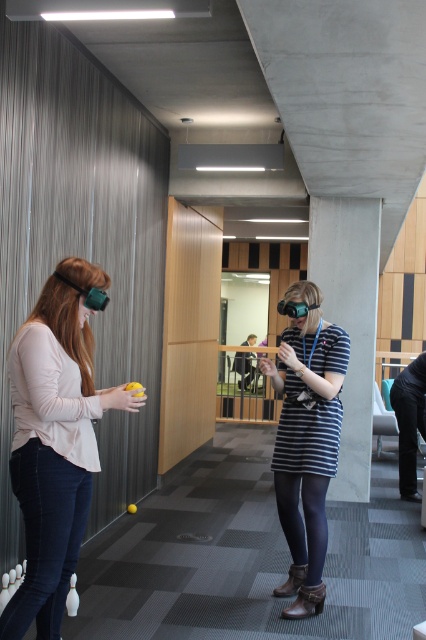
Where is `striped fabric dress at center`? This screenshot has height=640, width=426. striped fabric dress at center is located at coordinates (307, 448).

Is striped fabric dress at center to the right of white marble pillar at center from the viewer's perspective?

In fact, striped fabric dress at center is to the left of white marble pillar at center.

Who is more distant from viewer, (x=321, y=420) or (x=347, y=464)?

The point (x=347, y=464) is behind.

Where is `striped fabric dress at center`? Image resolution: width=426 pixels, height=640 pixels. striped fabric dress at center is located at coordinates (307, 448).

Looking at this image, is white marble pillar at center to the right of matte black goggles at center from the viewer's perspective?

Indeed, white marble pillar at center is positioned on the right side of matte black goggles at center.

Which of these two, white marble pillar at center or matte black goggles at center, stands taller?

Standing taller between the two is white marble pillar at center.

Measure the distance between point [319,282] and camera.

Point [319,282] is 19.20 feet away from camera.

I want to click on white marble pillar at center, so click(350, 321).

Is matte green vr headset at left wider than matte black goggles at center?

Yes, matte green vr headset at left is wider than matte black goggles at center.

Is matte green vr headset at left taller than matte black goggles at center?

Yes, matte green vr headset at left is taller than matte black goggles at center.

Is point (11, 356) in front of point (278, 308)?

Yes, it is.

Locate an element on the screen. Image resolution: width=426 pixels, height=640 pixels. matte green vr headset at left is located at coordinates (54, 451).